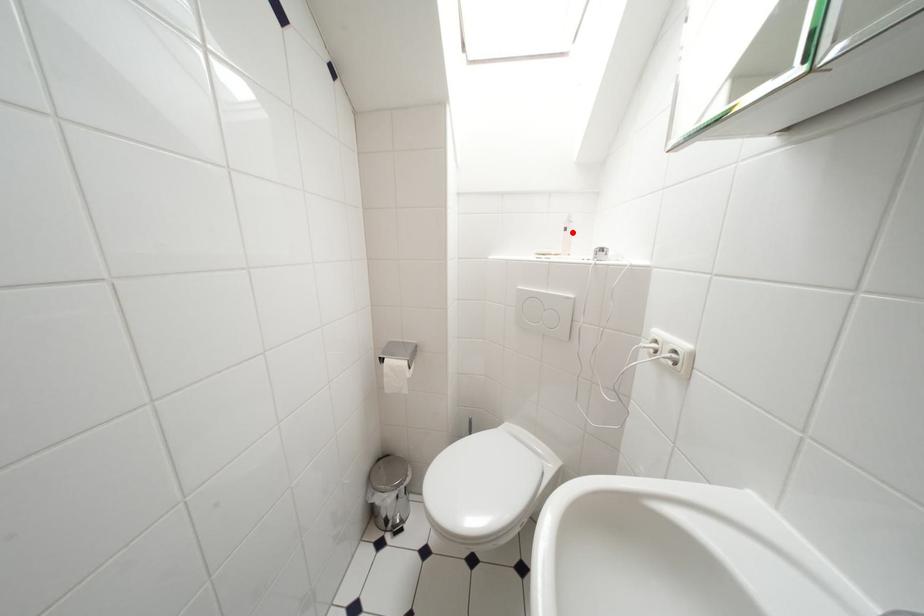
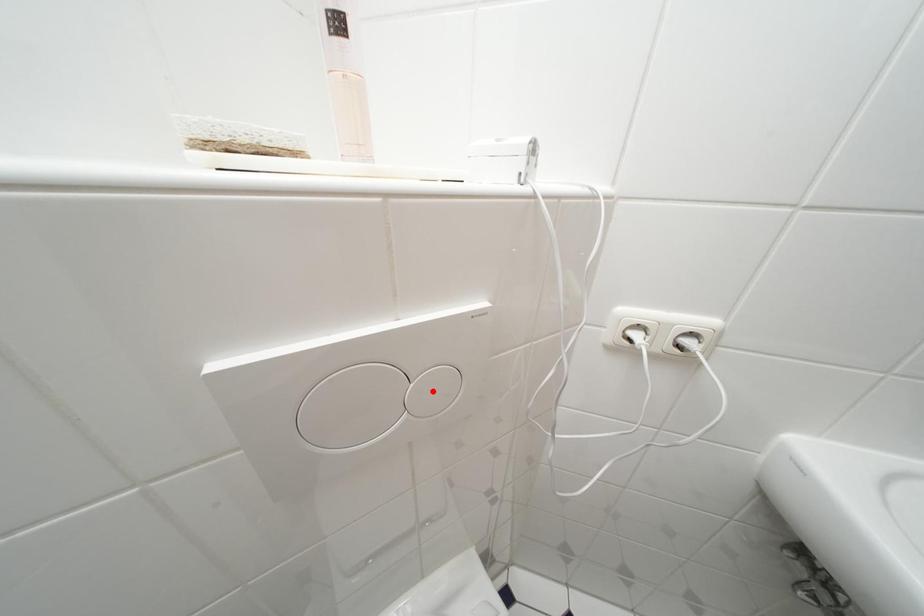
I am providing you with two images of the same scene from different viewpoints. A red point is marked on the first image and another point is marked on the second image. Does the point marked in image1 correspond to the same location as the one in image2?

No